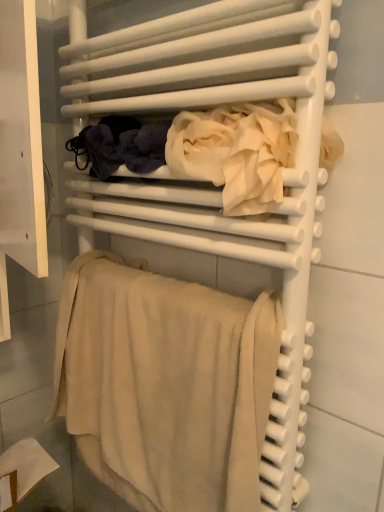
Image resolution: width=384 pixels, height=512 pixels. I want to click on free spot above white cotton towel at center (from a real-world perspective), so click(241, 92).